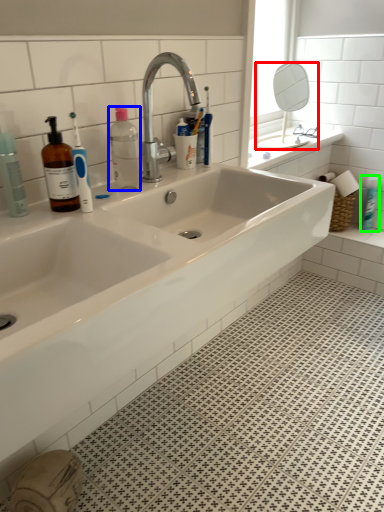
Question: Which is nearer to the mirror (highlighted by a red box)? bottle (highlighted by a blue box) or toiletry (highlighted by a green box).

Choices:
 (A) bottle
 (B) toiletry

Answer: (B)